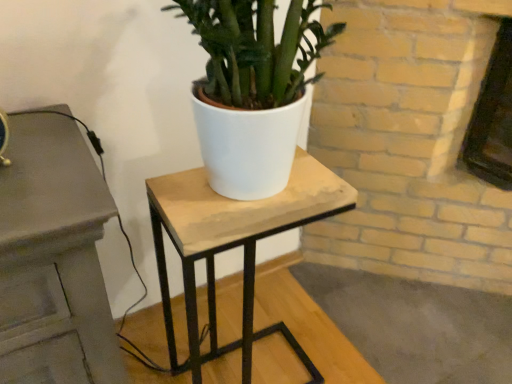
The image size is (512, 384). In order to click on free spot above wooden table at center (from a real-world perspective) in this screenshot , I will do (245, 198).